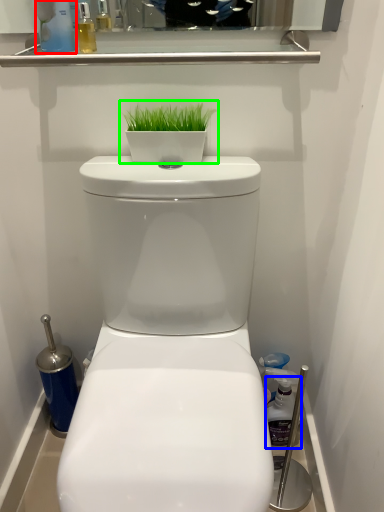
Question: Which object is the farthest from cleaning product (highlighted by a red box)? Choose among these: cleaning product (highlighted by a blue box) or houseplant (highlighted by a green box).

Choices:
 (A) cleaning product
 (B) houseplant

Answer: (A)